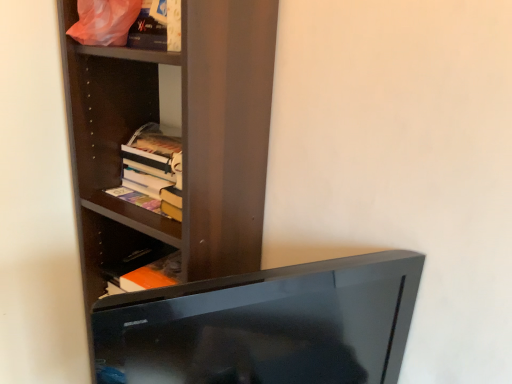
Question: Is black glossy tv at lower center positioned in front of dark wood shelf at upper left?

Choices:
 (A) yes
 (B) no

Answer: (A)

Question: Considering the relative sizes of black glossy tv at lower center and dark wood shelf at upper left in the image provided, is black glossy tv at lower center bigger than dark wood shelf at upper left?

Choices:
 (A) no
 (B) yes

Answer: (A)

Question: Would you consider black glossy tv at lower center to be distant from dark wood shelf at upper left?

Choices:
 (A) yes
 (B) no

Answer: (B)

Question: From the image's perspective, is black glossy tv at lower center beneath dark wood shelf at upper left?

Choices:
 (A) yes
 (B) no

Answer: (A)

Question: Does black glossy tv at lower center turn towards dark wood shelf at upper left?

Choices:
 (A) yes
 (B) no

Answer: (B)

Question: Considering the relative sizes of black glossy tv at lower center and dark wood shelf at upper left in the image provided, is black glossy tv at lower center wider than dark wood shelf at upper left?

Choices:
 (A) yes
 (B) no

Answer: (B)

Question: Is matte plastic bag at upper left aimed at black glossy tv at lower center?

Choices:
 (A) yes
 (B) no

Answer: (B)

Question: Is matte plastic bag at upper left to the left of black glossy tv at lower center from the viewer's perspective?

Choices:
 (A) yes
 (B) no

Answer: (A)

Question: Is matte plastic bag at upper left positioned in front of black glossy tv at lower center?

Choices:
 (A) yes
 (B) no

Answer: (B)

Question: Is the depth of matte plastic bag at upper left greater than that of black glossy tv at lower center?

Choices:
 (A) yes
 (B) no

Answer: (A)

Question: From a real-world perspective, is matte plastic bag at upper left over black glossy tv at lower center?

Choices:
 (A) no
 (B) yes

Answer: (B)

Question: Can we say matte plastic bag at upper left lies outside black glossy tv at lower center?

Choices:
 (A) no
 (B) yes

Answer: (B)

Question: Could black glossy tv at lower center be considered to be inside dark wood shelf at upper left?

Choices:
 (A) no
 (B) yes

Answer: (A)